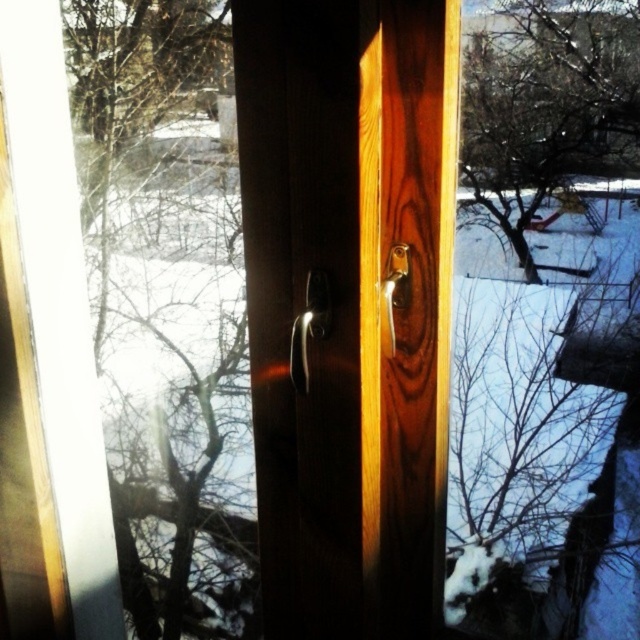
Is polished metallic door handle at center further to the viewer compared to polished brass door handle at center?

No.

Between point (317, 308) and point (406, 273), which one is positioned behind?

Point (406, 273)

Measure the distance between point (323, 284) and camera.

They are 1.00 meters apart.

Locate an element on the screen. polished metallic door handle at center is located at coordinates (308, 326).

Which of these two, satin wood door handle at center or polished brass door handle at center, stands taller?

With more height is satin wood door handle at center.

Is satin wood door handle at center taller than polished brass door handle at center?

Yes.

What do you see at coordinates (348, 305) in the screenshot?
I see `satin wood door handle at center` at bounding box center [348, 305].

Find the location of `satin wood door handle at center`. satin wood door handle at center is located at coordinates (348, 305).

Who is lower down, satin wood door handle at center or polished metallic door handle at center?

Positioned lower is satin wood door handle at center.

Can you confirm if satin wood door handle at center is thinner than polished metallic door handle at center?

No.

Locate an element on the screen. satin wood door handle at center is located at coordinates (348, 305).